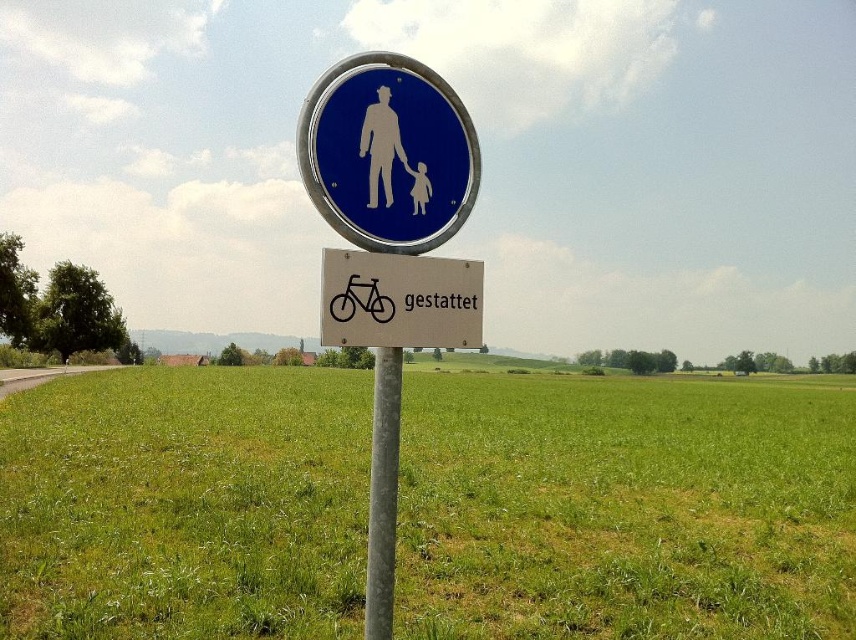
Question: Does green grass at center have a lesser width compared to white plastic bicycle at center?

Choices:
 (A) no
 (B) yes

Answer: (A)

Question: Considering the relative positions of blue glossy sign at upper center and white matte figure at upper center in the image provided, where is blue glossy sign at upper center located with respect to white matte figure at upper center?

Choices:
 (A) above
 (B) below

Answer: (A)

Question: Which object is closer to the camera taking this photo?

Choices:
 (A) white matte figure at upper center
 (B) green grass at center
 (C) blue glossy sign at upper center
 (D) metallic pole at center

Answer: (C)

Question: Among these points, which one is farthest from the camera?

Choices:
 (A) (372, 605)
 (B) (370, 131)

Answer: (B)

Question: Among these points, which one is nearest to the camera?

Choices:
 (A) (391, 516)
 (B) (406, 170)

Answer: (A)

Question: Can you confirm if blue glossy sign at upper center is smaller than white plastic bicycle at center?

Choices:
 (A) no
 (B) yes

Answer: (A)